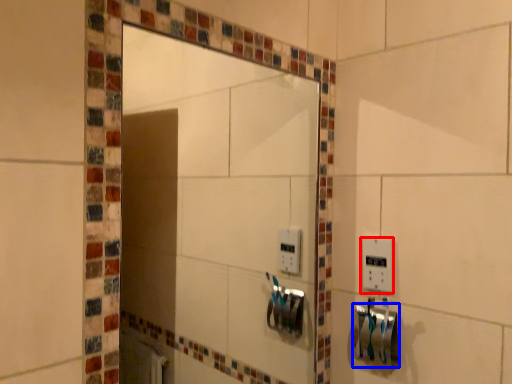
Question: Which point is further to the camera, light switch (highlighted by a red box) or towel bar (highlighted by a blue box)?

Choices:
 (A) light switch
 (B) towel bar

Answer: (A)